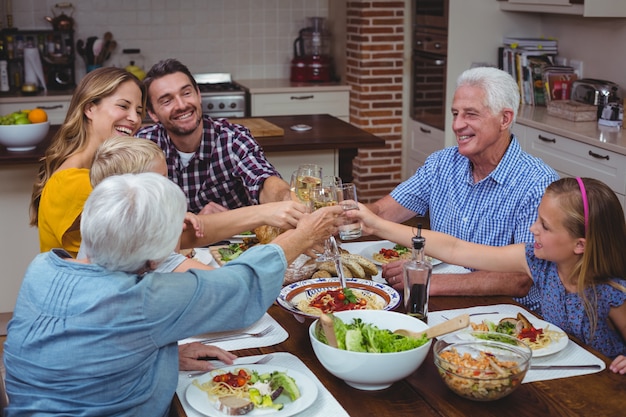
The width and height of the screenshot is (626, 417). In order to click on plates in this screenshot , I will do `click(367, 250)`, `click(285, 374)`, `click(479, 321)`, `click(203, 257)`.